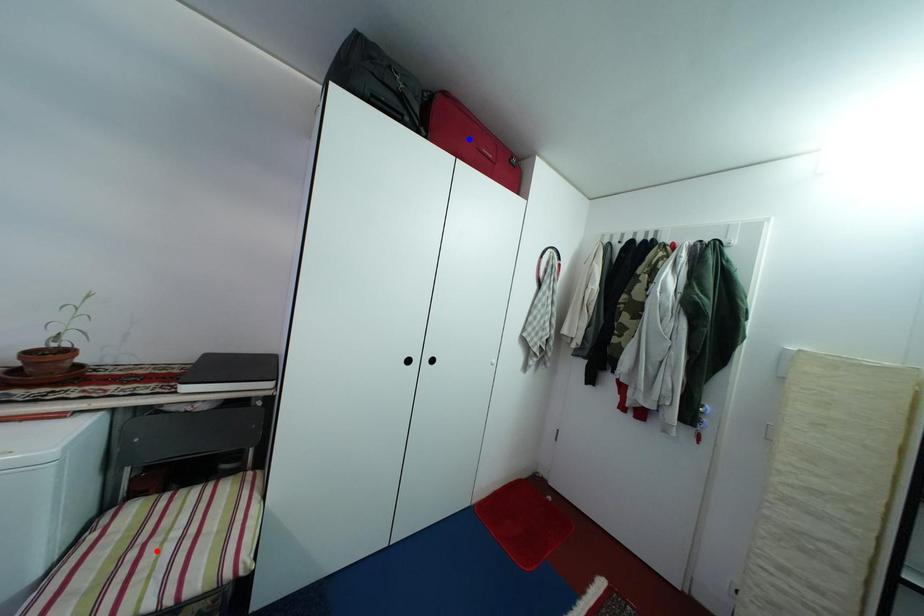
Question: Which of the two points in the image is closer to the camera?

Choices:
 (A) Blue point is closer.
 (B) Red point is closer.

Answer: (B)